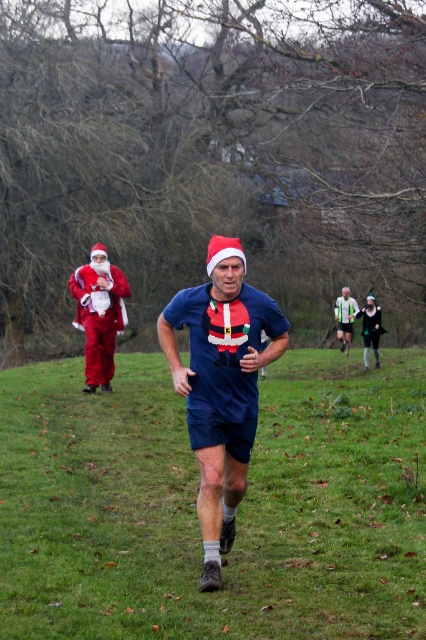
Is point (140, 369) more distant than point (232, 368)?

Yes, point (140, 369) is farther from viewer.

Locate an element on the screen. green grass at center is located at coordinates (195, 506).

What are the coordinates of `green grass at center` in the screenshot? It's located at (195, 506).

Does blue fabric shirt at center have a lesser width compared to matte white shirt at center?

In fact, blue fabric shirt at center might be wider than matte white shirt at center.

Does blue fabric shirt at center appear on the right side of matte white shirt at center?

In fact, blue fabric shirt at center is to the left of matte white shirt at center.

Where is `blue fabric shirt at center`? blue fabric shirt at center is located at coordinates (221, 385).

You are a GUI agent. You are given a task and a screenshot of the screen. Output one action in this format:
    pyautogui.click(x=<x>, y=<y>)
    Task: Click on the blue fabric shirt at center
    
    Given the screenshot: What is the action you would take?
    pyautogui.click(x=221, y=385)

Does velvet santa at left appear under matte white shirt at center?

Actually, velvet santa at left is above matte white shirt at center.

Based on the photo, who is lower down, velvet santa at left or matte white shirt at center?

Positioned lower is matte white shirt at center.

Is point (98, 371) positioned before point (347, 321)?

Yes, point (98, 371) is in front of point (347, 321).

Locate an element on the screen. velvet santa at left is located at coordinates (98, 314).